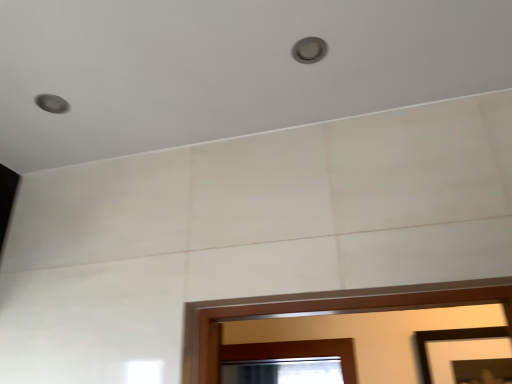
Question: Is black matte picture frame at lower right wider or thinner than matte silver light at upper center?

Choices:
 (A) thin
 (B) wide

Answer: (A)

Question: In the image, is black matte picture frame at lower right positioned in front of or behind matte silver light at upper center?

Choices:
 (A) front
 (B) behind

Answer: (B)

Question: From the image's perspective, is black matte picture frame at lower right above or below matte silver light at upper center?

Choices:
 (A) above
 (B) below

Answer: (B)

Question: Is matte silver light at upper center inside the boundaries of black matte picture frame at lower right, or outside?

Choices:
 (A) outside
 (B) inside

Answer: (A)

Question: Considering the positions of point (316, 44) and point (415, 334), is point (316, 44) closer or farther from the camera than point (415, 334)?

Choices:
 (A) closer
 (B) farther

Answer: (A)

Question: In the image, is matte silver light at upper center on the left side or the right side of black matte picture frame at lower right?

Choices:
 (A) right
 (B) left

Answer: (B)

Question: From their relative heights in the image, would you say matte silver light at upper center is taller or shorter than black matte picture frame at lower right?

Choices:
 (A) short
 (B) tall

Answer: (A)